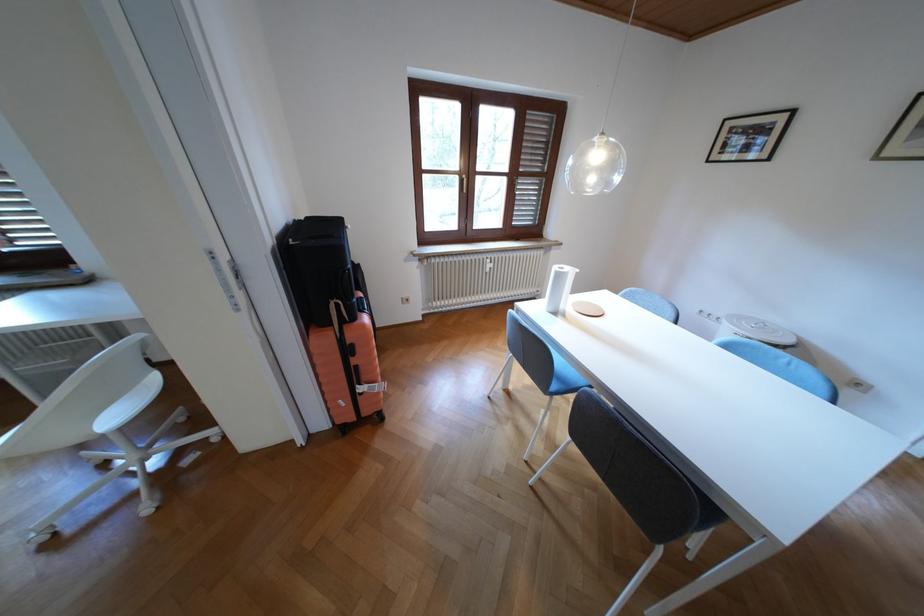
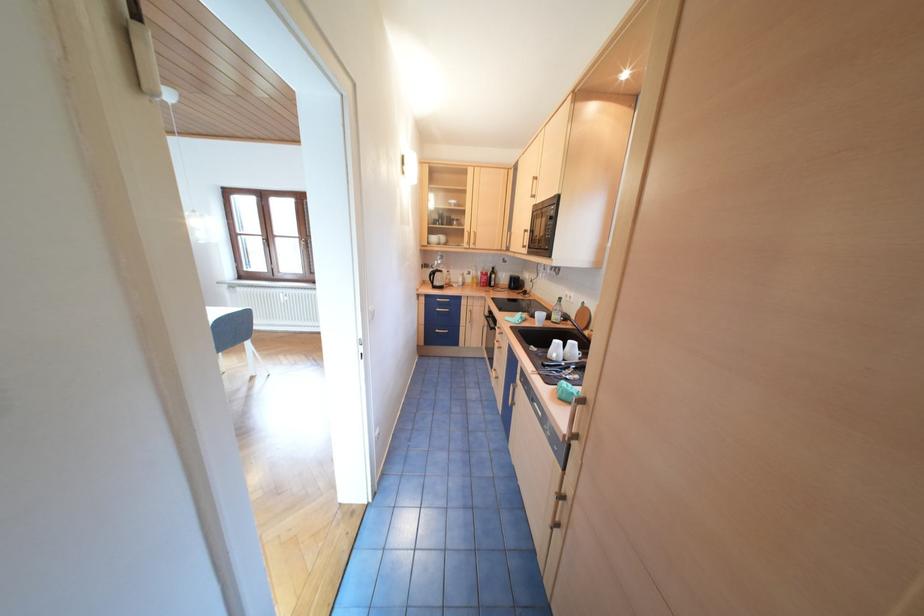
Question: Which direction would the cameraman need to move to produce the second image? Reply with the corresponding letter.

Choices:
 (A) Left
 (B) Right
 (C) Forward
 (D) Backward

Answer: (B)